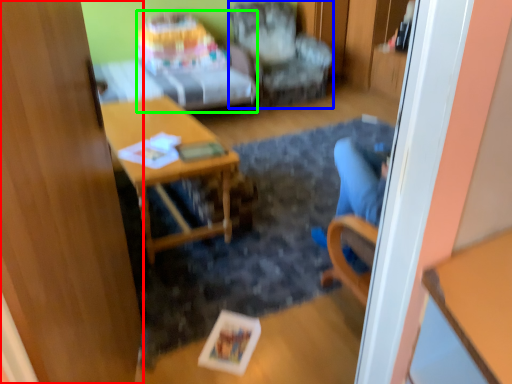
Question: Which object is the farthest from glass door (highlighted by a red box)? Choose among these: chair (highlighted by a blue box) or studio couch (highlighted by a green box).

Choices:
 (A) chair
 (B) studio couch

Answer: (A)